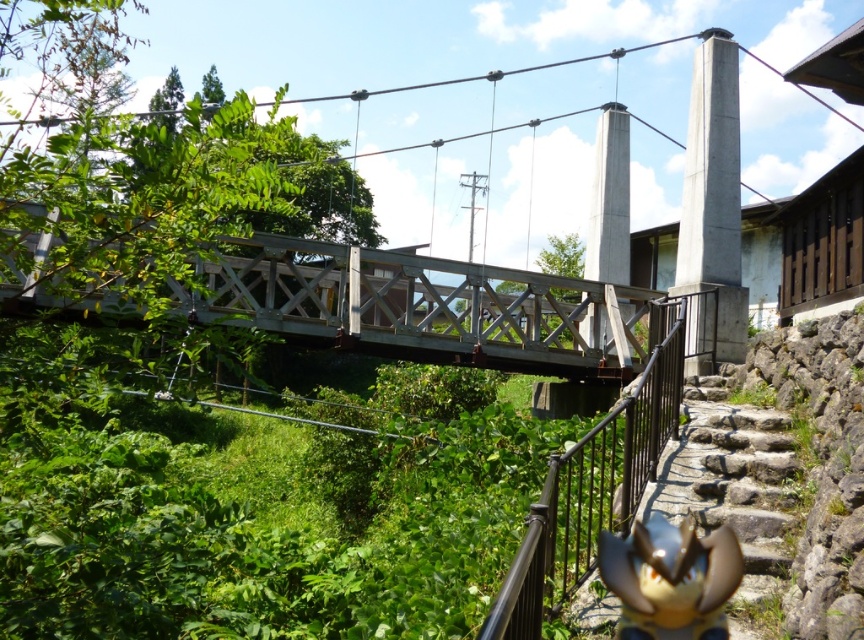
Question: Which of the following is the farthest from the observer?

Choices:
 (A) click(713, 438)
 (B) click(560, 513)

Answer: (A)

Question: Does wooden bridge at center have a greater width compared to stone/stone stairs at lower right?

Choices:
 (A) no
 (B) yes

Answer: (B)

Question: Which of these objects is positioned farthest from the wooden bridge at center?

Choices:
 (A) stone/stone stairs at lower right
 (B) black metal railing at center

Answer: (A)

Question: Which object appears farthest from the camera in this image?

Choices:
 (A) black metal railing at center
 (B) wooden bridge at center
 (C) stone/stone stairs at lower right

Answer: (C)

Question: Is wooden bridge at center closer to the viewer compared to stone/stone stairs at lower right?

Choices:
 (A) no
 (B) yes

Answer: (B)

Question: Is wooden bridge at center bigger than stone/stone stairs at lower right?

Choices:
 (A) yes
 (B) no

Answer: (A)